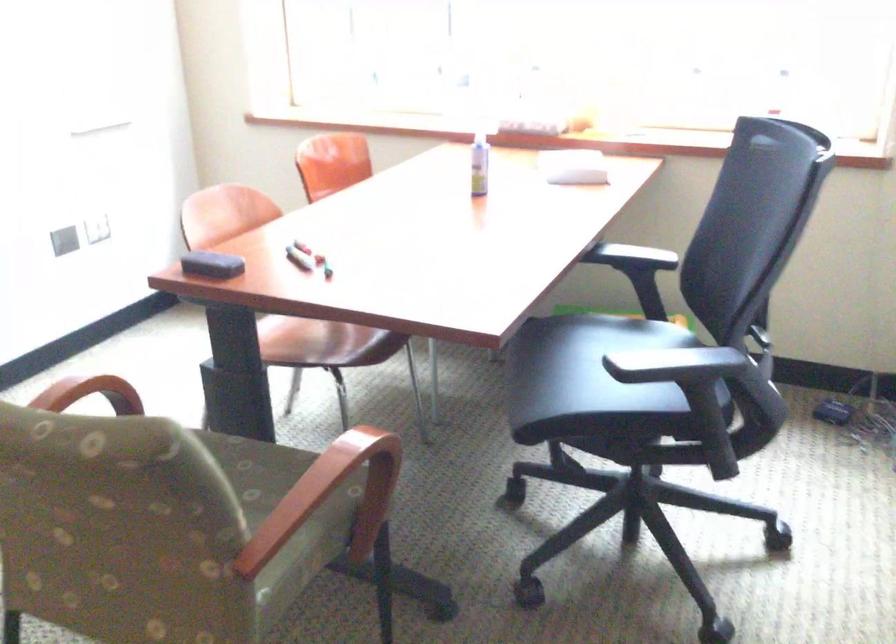
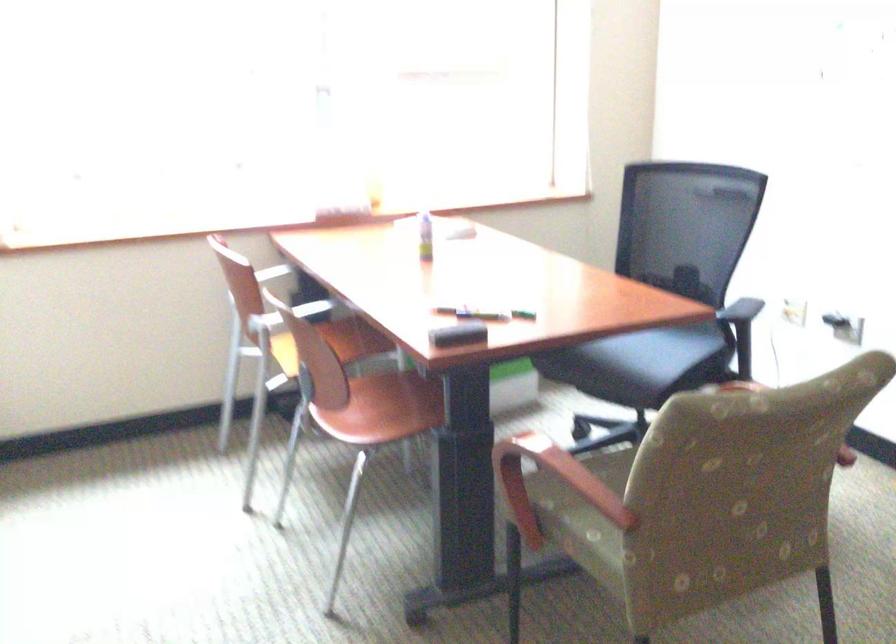
Question: I am providing you with two images of the same scene from different viewpoints. Which of the following objects are not visible in image2?

Choices:
 (A) white iron handle
 (B) wooden chair armrest
 (C) black chair armrest
 (D) chair sitting surface

Answer: (C)